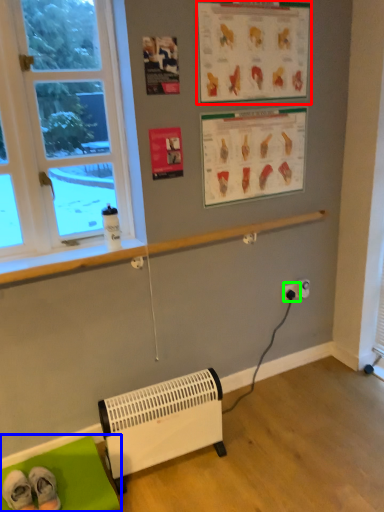
Question: Based on their relative distances, which object is nearer to writing (highlighted by a red box)? Choose from furniture (highlighted by a blue box) and electric outlet (highlighted by a green box).

Choices:
 (A) furniture
 (B) electric outlet

Answer: (B)